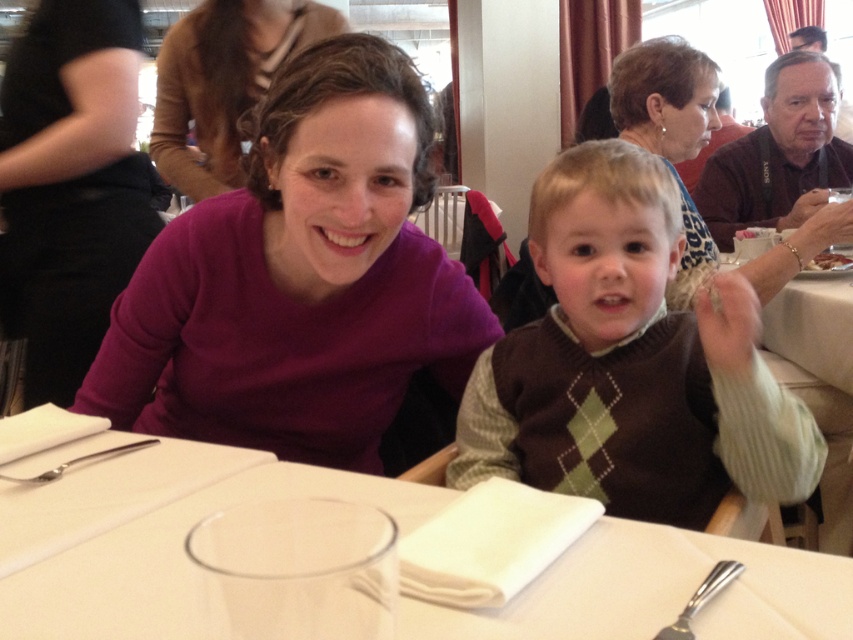
Question: Can you confirm if white cloth at center is positioned below matte purple sweater at center?

Choices:
 (A) yes
 (B) no

Answer: (A)

Question: Does matte purple sweater at center lie behind silver metallic spoon at lower left?

Choices:
 (A) yes
 (B) no

Answer: (A)

Question: Estimate the real-world distances between objects in this image. Which object is farther from the matte purple sweater at center?

Choices:
 (A) purple matte sweater at upper left
 (B) white cloth at center

Answer: (B)

Question: Considering the relative positions of matte purple sweater at center and purple sweater at upper left in the image provided, where is matte purple sweater at center located with respect to purple sweater at upper left?

Choices:
 (A) right
 (B) left

Answer: (B)

Question: Which object is the closest to the matte purple sweater at center?

Choices:
 (A) silver metallic spoon at lower right
 (B) purple matte sweater at upper left

Answer: (B)

Question: Which point is farther to the camera?

Choices:
 (A) brown argyle sweater vest at center
 (B) silver metallic spoon at lower left
 (C) matte purple sweater at upper left
 (D) brown crumbly cake at right

Answer: (D)